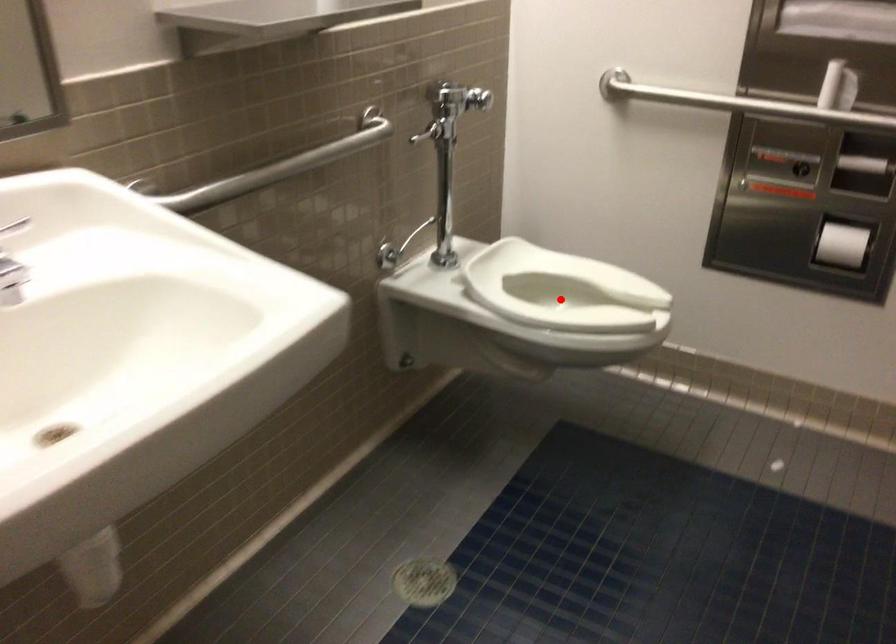
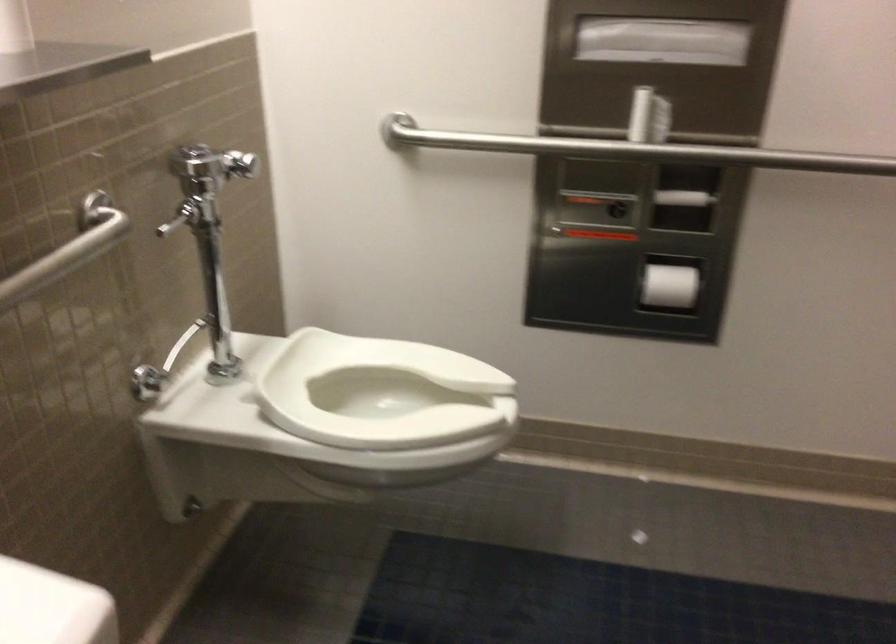
Locate, in the second image, the point that corresponds to the highlighted location in the first image.

(381, 393)